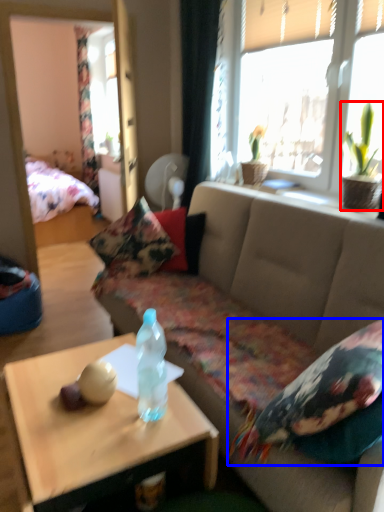
Question: Which of the following is the farthest to the observer, houseplant (highlighted by a red box) or pillow (highlighted by a blue box)?

Choices:
 (A) houseplant
 (B) pillow

Answer: (A)